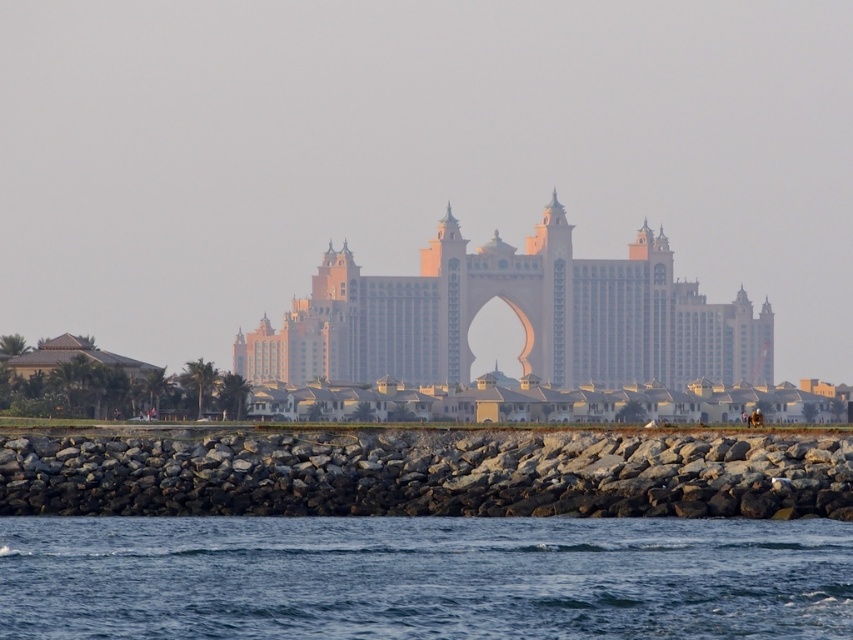
Can you confirm if blue water at lower center is bigger than golden stone palace at center?

Correct, blue water at lower center is larger in size than golden stone palace at center.

Does point (642, 624) come behind point (335, 352)?

No, it is in front of (335, 352).

I want to click on blue water at lower center, so [422, 577].

Which of these two, gray rock wall at lower center or golden stone palace at center, stands taller?

golden stone palace at center is taller.

Is point (798, 438) less distant than point (431, 262)?

Yes, it is.

Which is behind, point (541, 477) or point (752, 348)?

The point (752, 348) is behind.

The height and width of the screenshot is (640, 853). I want to click on gray rock wall at lower center, so click(428, 476).

Does point (105, 621) come farther from viewer compared to point (753, 499)?

Yes.

Is the position of blue water at lower center less distant than that of gray rock wall at lower center?

No, blue water at lower center is further to the viewer.

Locate an element on the screen. blue water at lower center is located at coordinates (422, 577).